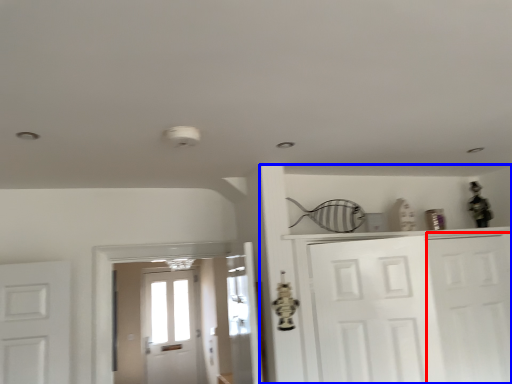
Question: Which object is closer to the camera taking this photo, door (highlighted by a red box) or dresser (highlighted by a blue box)?

Choices:
 (A) door
 (B) dresser

Answer: (B)